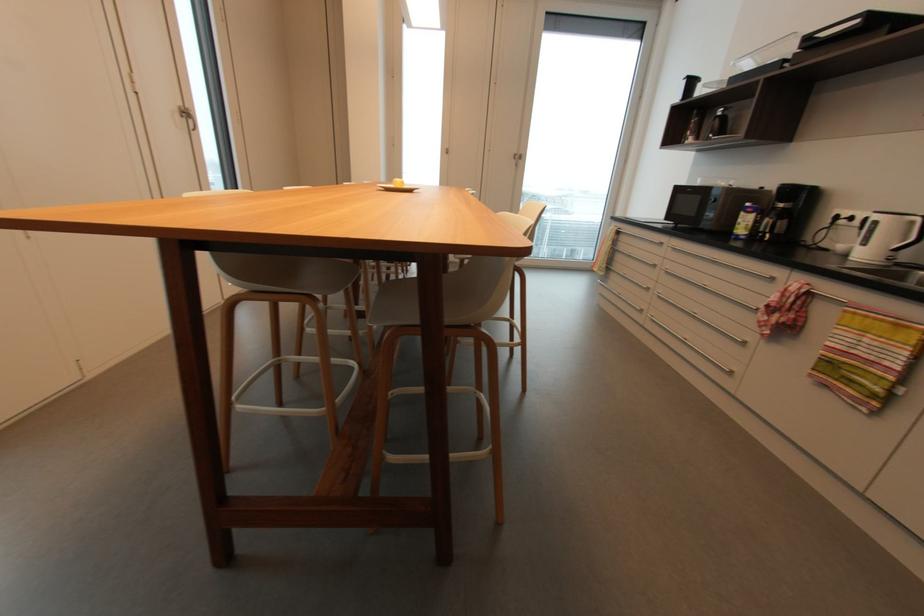
The height and width of the screenshot is (616, 924). What do you see at coordinates (718, 265) in the screenshot?
I see `a metal drawer handle` at bounding box center [718, 265].